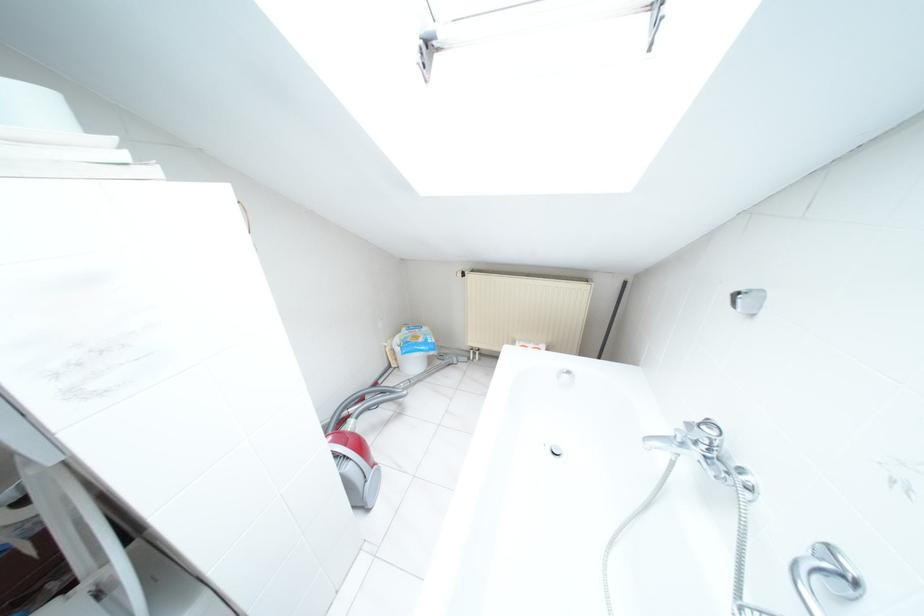
The width and height of the screenshot is (924, 616). What do you see at coordinates (827, 570) in the screenshot? I see `a faucet diverter` at bounding box center [827, 570].